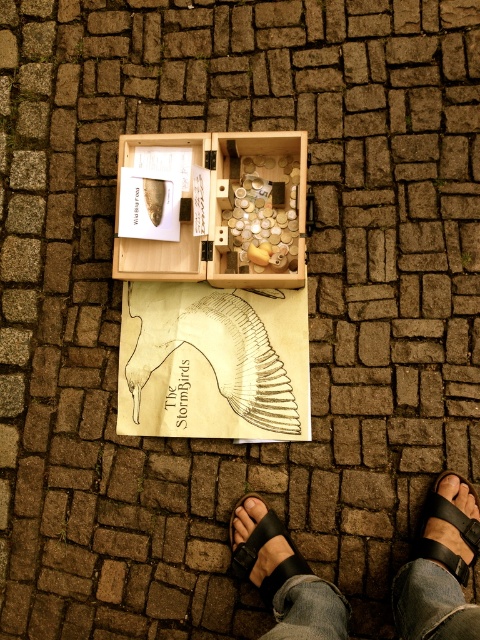
You are a delivery person who needs to place a small package in the wooden box. The package is 5 cm thick. Can the package fit in the space between the black leather sandal at lower right and the black leather sandal at lower center?

The black leather sandal at lower right is thinner than the black leather sandal at lower center. The space between them is not specified, so we cannot determine if the package will fit.

You are standing in a park and see the wooden box at center and the black leather sandal at lower center. Which object is closer to you?

The wooden box at center is closer to you because it is further to the viewer than the black leather sandal at lower center.